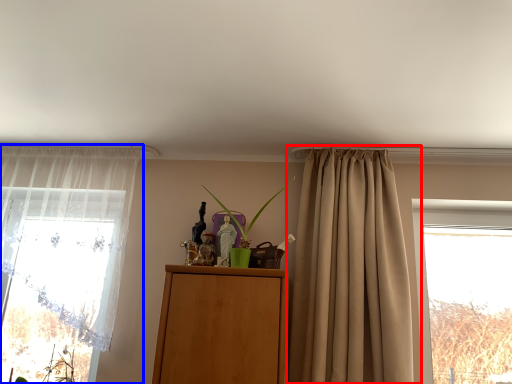
Question: Which point is further to the camera, curtain (highlighted by a red box) or curtain (highlighted by a blue box)?

Choices:
 (A) curtain
 (B) curtain

Answer: (B)